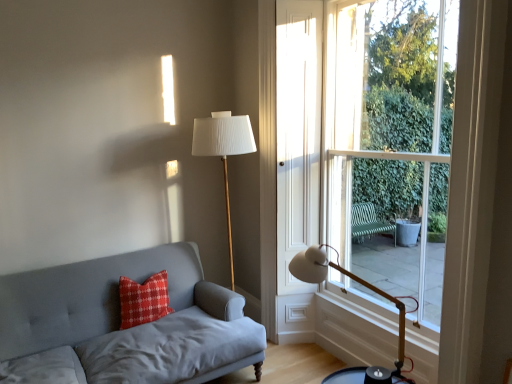
Question: Considering their positions, is clear glass window at right located in front of or behind white pleated fabric lampshade at center, marked as the first table lamp in a left-to-right arrangement?

Choices:
 (A) behind
 (B) front

Answer: (B)

Question: Is point (331, 112) positioned closer to the camera than point (247, 137)?

Choices:
 (A) closer
 (B) farther

Answer: (B)

Question: Considering the real-world distances, which object is farthest from the matte gray fabric couch at left?

Choices:
 (A) white pleated fabric lampshade at center, which is the first table lamp from back to front
 (B) red textured pillow at left
 (C) white matte table lamp at lower right, positioned as the second table lamp in back-to-front order
 (D) clear glass window at right

Answer: (C)

Question: Based on their relative distances, which object is farther from the white pleated fabric lampshade at center, the second table lamp when ordered from front to back?

Choices:
 (A) matte gray fabric couch at left
 (B) white matte table lamp at lower right, positioned as the second table lamp in back-to-front order
 (C) clear glass window at right
 (D) red textured pillow at left

Answer: (B)